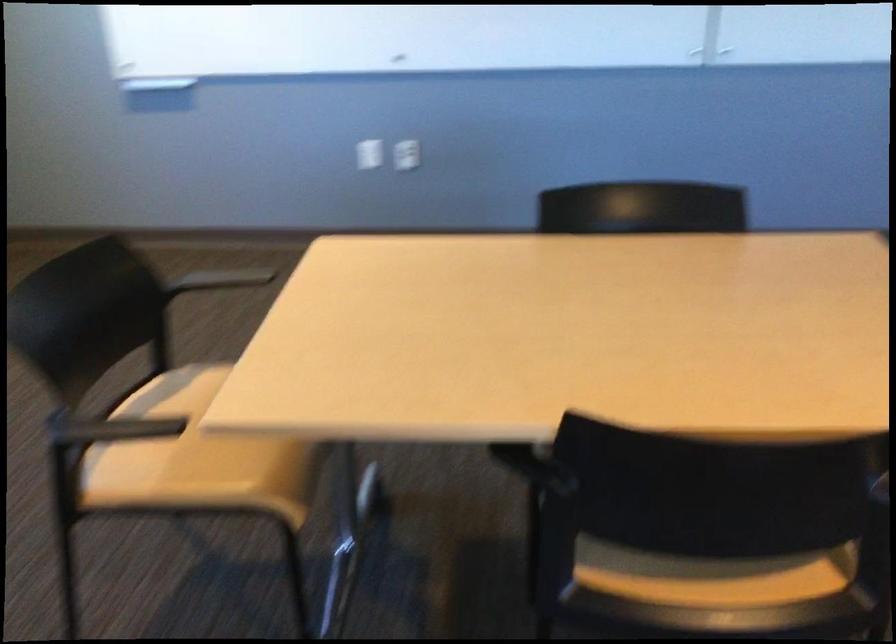
Question: The camera is either moving clockwise (left) or counter-clockwise (right) around the object. The first image is from the beginning of the video and the second image is from the end. Is the camera moving left or right when shooting the video?

Choices:
 (A) Left
 (B) Right

Answer: (A)